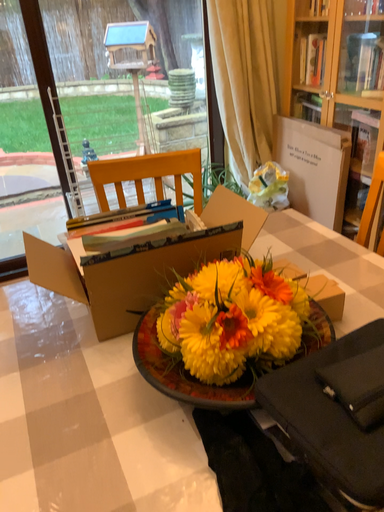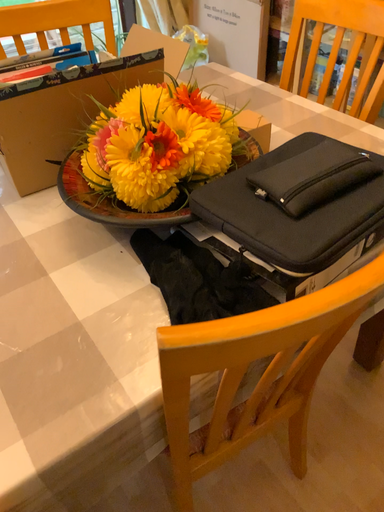
Question: How did the camera likely rotate when shooting the video?

Choices:
 (A) rotated right
 (B) rotated left

Answer: (A)